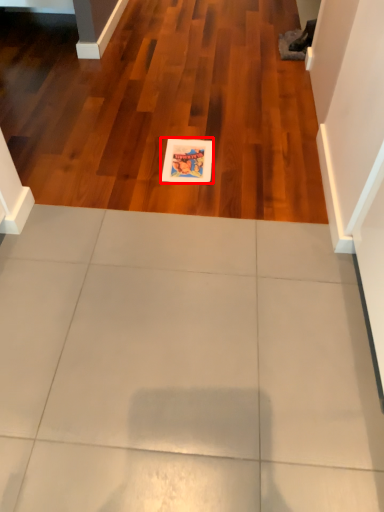
Question: From the image's perspective, where is postcard (annotated by the red box) located relative to ceramic tile?

Choices:
 (A) above
 (B) below

Answer: (B)